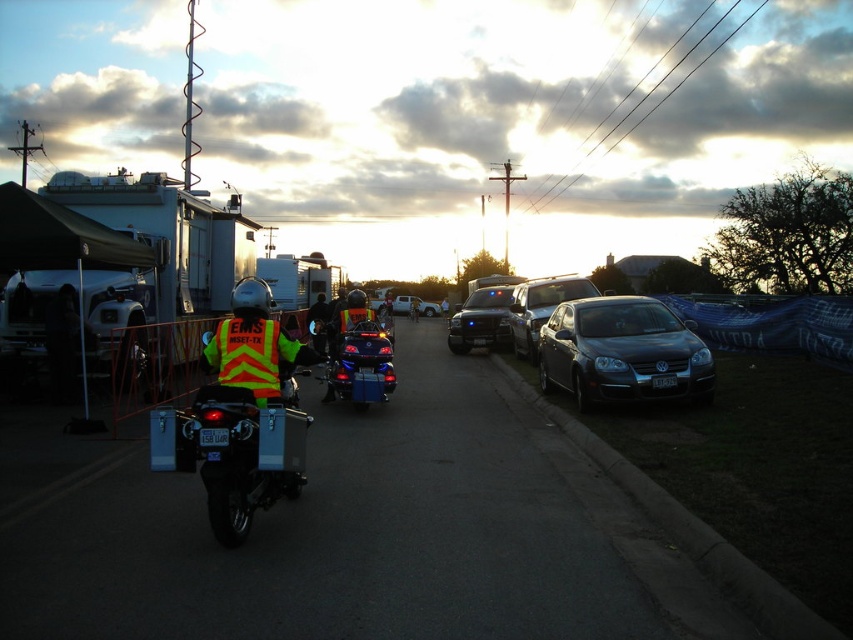
Does matte black sedan at center appear on the left side of shiny blue motorcycle at center?

In fact, matte black sedan at center is to the right of shiny blue motorcycle at center.

Is point (556, 324) less distant than point (380, 330)?

No, (556, 324) is further to viewer.

The height and width of the screenshot is (640, 853). In order to click on matte black sedan at center in this screenshot , I will do `click(622, 353)`.

From the picture: Is reflective yellow-green vest at center bigger than reflective yellow safety vest at center?

Yes, reflective yellow-green vest at center is bigger than reflective yellow safety vest at center.

Based on the photo, can you confirm if reflective yellow-green vest at center is thinner than reflective yellow safety vest at center?

In fact, reflective yellow-green vest at center might be wider than reflective yellow safety vest at center.

Which is in front, point (195, 451) or point (218, 356)?

Positioned in front is point (195, 451).

Image resolution: width=853 pixels, height=640 pixels. I want to click on reflective yellow-green vest at center, so click(x=235, y=458).

This screenshot has height=640, width=853. What do you see at coordinates (235, 458) in the screenshot? I see `reflective yellow-green vest at center` at bounding box center [235, 458].

Locate an element on the screen. reflective yellow-green vest at center is located at coordinates (235, 458).